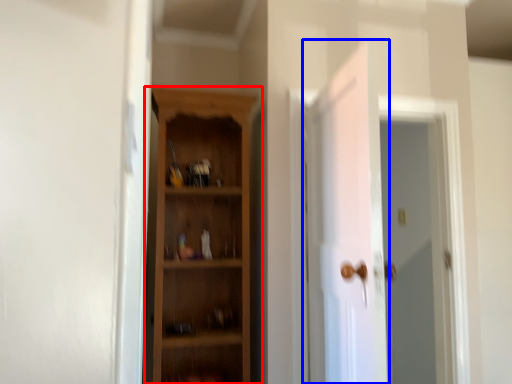
Question: Which object is further to the camera taking this photo, cupboard (highlighted by a red box) or door (highlighted by a blue box)?

Choices:
 (A) cupboard
 (B) door

Answer: (A)